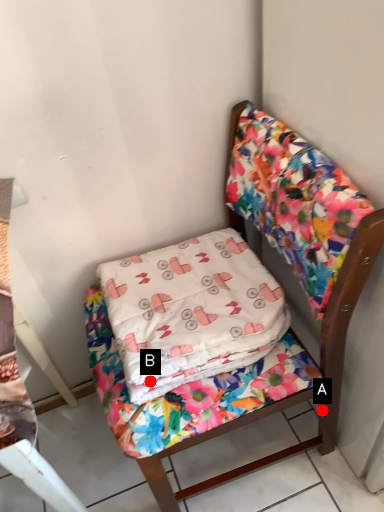
Question: Two points are circled on the image, labeled by A and B beside each circle. Which point appears closest to the camera in this image?

Choices:
 (A) A is closer
 (B) B is closer

Answer: (B)